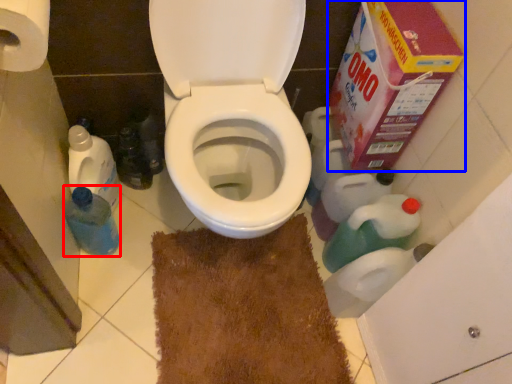
Question: Among these objects, which one is nearest to the camera, bottle (highlighted by a red box) or cardboard box (highlighted by a blue box)?

Choices:
 (A) bottle
 (B) cardboard box

Answer: (B)